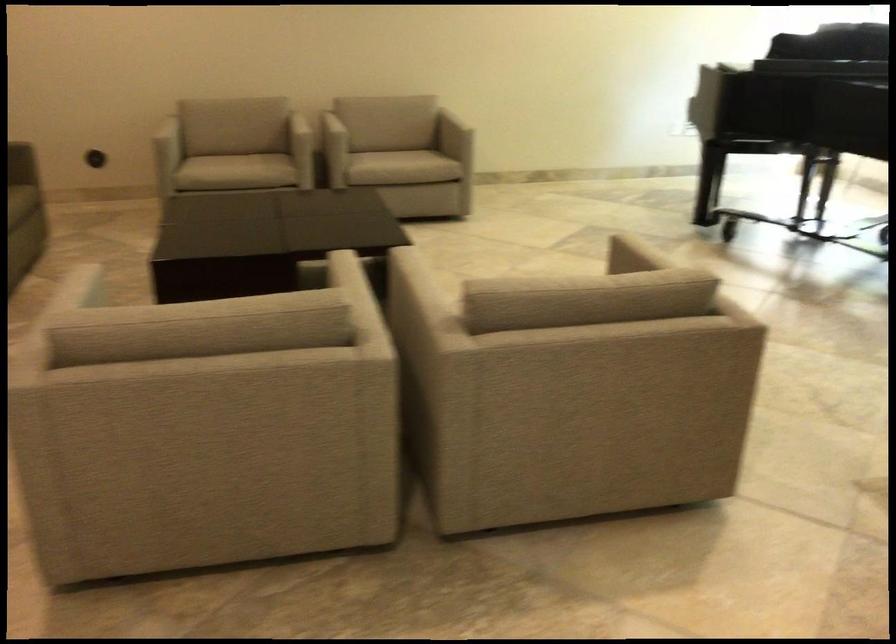
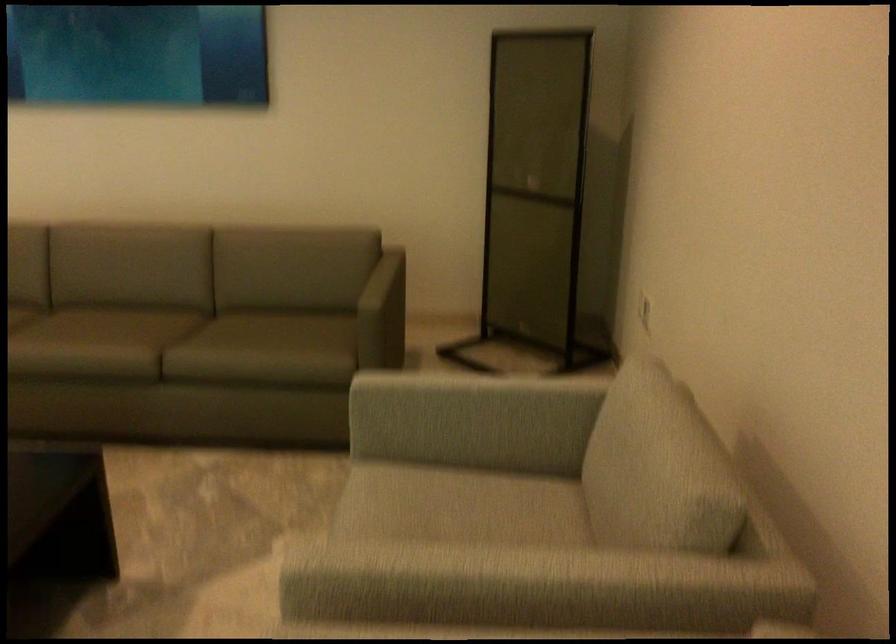
Locate, in the second image, the point that corresponds to [168,126] in the first image.

(469, 399)